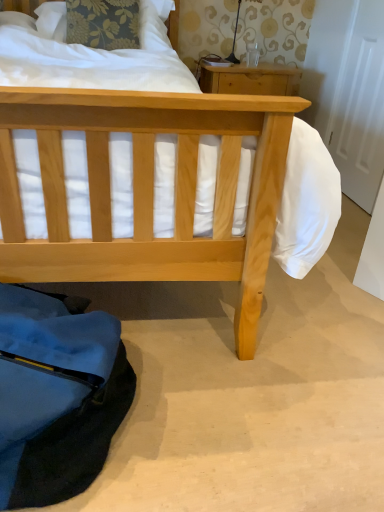
This screenshot has height=512, width=384. What do you see at coordinates (52, 20) in the screenshot? I see `floral fabric pillow at upper left` at bounding box center [52, 20].

Measure the distance between matte black lamp at upper center and camera.

A distance of 2.70 meters exists between matte black lamp at upper center and camera.

What do you see at coordinates (250, 80) in the screenshot? I see `natural wood nightstand at upper center` at bounding box center [250, 80].

In order to click on floral fabric pillow at upper left in this screenshot , I will do pyautogui.click(x=52, y=20).

Looking at their sizes, would you say natural wood nightstand at upper center is wider or thinner than floral fabric pillow at upper left?

Considering their sizes, natural wood nightstand at upper center looks broader than floral fabric pillow at upper left.

How different are the orientations of natural wood nightstand at upper center and floral fabric pillow at upper left in degrees?

The angular difference between natural wood nightstand at upper center and floral fabric pillow at upper left is 9.56 degrees.

Based on the photo, who is smaller, natural wood nightstand at upper center or floral fabric pillow at upper left?

With smaller size is floral fabric pillow at upper left.

Choose the correct answer: Is natural wood nightstand at upper center inside floral fabric pillow at upper left or outside it?

natural wood nightstand at upper center is not inside floral fabric pillow at upper left, it's outside.

In the scene shown: From the image's perspective, does floral fabric pillow at upper left appear higher than matte black lamp at upper center?

Incorrect, from the image's perspective, floral fabric pillow at upper left is lower than matte black lamp at upper center.

Is floral fabric pillow at upper left positioned with its back to matte black lamp at upper center?

No, floral fabric pillow at upper left is not facing the opposite direction of matte black lamp at upper center.

This screenshot has width=384, height=512. In order to click on table lamp located behind the floral fabric pillow at upper left in this screenshot , I will do `click(234, 40)`.

Is floral fabric pillow at upper left to the left or to the right of matte black lamp at upper center in the image?

floral fabric pillow at upper left is positioned on matte black lamp at upper center's left side.

This screenshot has height=512, width=384. In the image, there is a floral fabric pillow at upper left. What are the coordinates of `table below it (from a real-world perspective)` in the screenshot? It's located at (250, 80).

From the picture: Is floral fabric pillow at upper left placed right next to natural wood nightstand at upper center?

They are not placed beside each other.

From the image's perspective, is floral fabric pillow at upper left located above or below natural wood nightstand at upper center?

Based on their image positions, floral fabric pillow at upper left is located above natural wood nightstand at upper center.

Is floral fabric pillow at upper left closer to the viewer compared to natural wood nightstand at upper center?

Yes, floral fabric pillow at upper left is closer to the viewer.

Is matte black lamp at upper center smaller than floral fabric pillow at upper left?

Yes.

Image resolution: width=384 pixels, height=512 pixels. In order to click on pillow that is below the matte black lamp at upper center (from the image's perspective) in this screenshot , I will do `click(52, 20)`.

From the picture: Considering the positions of objects matte black lamp at upper center and floral fabric pillow at upper left in the image provided, who is more to the right, matte black lamp at upper center or floral fabric pillow at upper left?

From the viewer's perspective, matte black lamp at upper center appears more on the right side.

Between matte black lamp at upper center and floral fabric pillow at upper left, which one has larger width?

floral fabric pillow at upper left.

In terms of height, does matte black lamp at upper center look taller or shorter compared to natural wood nightstand at upper center?

Considering their sizes, matte black lamp at upper center has less height than natural wood nightstand at upper center.

Is point (240, 1) farther from camera compared to point (297, 85)?

Yes, point (240, 1) is behind point (297, 85).

Are matte black lamp at upper center and natural wood nightstand at upper center making contact?

matte black lamp at upper center and natural wood nightstand at upper center are clearly separated.

Can you confirm if matte black lamp at upper center is thinner than natural wood nightstand at upper center?

Yes, matte black lamp at upper center is thinner than natural wood nightstand at upper center.

Which of these two, natural wood nightstand at upper center or matte black lamp at upper center, is wider?

With larger width is natural wood nightstand at upper center.

Consider the image. Which object is positioned more to the left, natural wood nightstand at upper center or matte black lamp at upper center?

From the viewer's perspective, matte black lamp at upper center appears more on the left side.

From a real-world perspective, who is located higher, natural wood nightstand at upper center or matte black lamp at upper center?

From a 3D spatial view, matte black lamp at upper center is above.

Which object is further away from the camera, natural wood nightstand at upper center or matte black lamp at upper center?

matte black lamp at upper center is behind.

I want to click on pillow positioned vertically above the natural wood nightstand at upper center (from a real-world perspective), so click(52, 20).

Find the location of a particular element. Image resolution: width=384 pixels, height=512 pixels. pillow below the matte black lamp at upper center (from the image's perspective) is located at coordinates (52, 20).

Based on their spatial positions, is floral fabric pillow at upper left or natural wood nightstand at upper center closer to matte black lamp at upper center?

natural wood nightstand at upper center lies closer to matte black lamp at upper center than the other object.

From the image, which object appears to be nearer to matte black lamp at upper center, natural wood nightstand at upper center or floral fabric pillow at upper left?

natural wood nightstand at upper center lies closer to matte black lamp at upper center than the other object.

Estimate the real-world distances between objects in this image. Which object is closer to floral fabric pillow at upper left, matte black lamp at upper center or natural wood nightstand at upper center?

matte black lamp at upper center is positioned closer to the anchor floral fabric pillow at upper left.

Consider the image. Which object lies nearer to the anchor point floral fabric pillow at upper left, natural wood nightstand at upper center or matte black lamp at upper center?

The object closer to floral fabric pillow at upper left is matte black lamp at upper center.

In the scene shown: Looking at the image, which one is located further to natural wood nightstand at upper center, matte black lamp at upper center or floral fabric pillow at upper left?

The object further to natural wood nightstand at upper center is floral fabric pillow at upper left.

Which object lies further to the anchor point natural wood nightstand at upper center, floral fabric pillow at upper left or matte black lamp at upper center?

The object further to natural wood nightstand at upper center is floral fabric pillow at upper left.

Locate an element on the screen. table lamp located between floral fabric pillow at upper left and natural wood nightstand at upper center in the left-right direction is located at coordinates tap(234, 40).